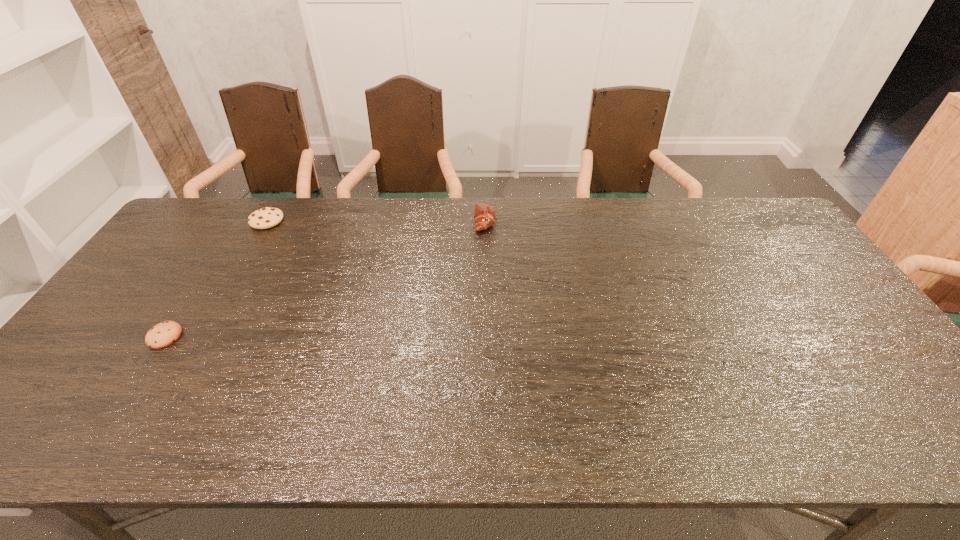
The width and height of the screenshot is (960, 540). I want to click on blank region between the nearest object and the crescent roll, so click(x=324, y=279).

You are a GUI agent. You are given a task and a screenshot of the screen. Output one action in this format:
    pyautogui.click(x=<x>, y=<y>)
    Task: Click on the vacant point located between the taller cookie and the nearer cookie
    The height and width of the screenshot is (540, 960).
    Given the screenshot: What is the action you would take?
    pyautogui.click(x=216, y=278)

At what (x,y) coordinates should I click in order to perform the action: click on unoccupied area between the taller cookie and the crescent roll. Please return your answer as a coordinate pair (x, y). This screenshot has width=960, height=540. Looking at the image, I should click on (375, 221).

Identify the location of free area in between the rightmost object and the taller cookie. This screenshot has height=540, width=960. (375, 221).

You are a GUI agent. You are given a task and a screenshot of the screen. Output one action in this format:
    pyautogui.click(x=<x>, y=<y>)
    Task: Click on the vacant area that lies between the second tallest object and the tallest object
    This screenshot has height=540, width=960.
    Given the screenshot: What is the action you would take?
    (x=375, y=221)

Locate an element on the screen. This screenshot has width=960, height=540. free space between the rightmost object and the farther cookie is located at coordinates (375, 221).

This screenshot has width=960, height=540. Find the location of `empty space that is in between the tallest object and the farther cookie`. empty space that is in between the tallest object and the farther cookie is located at coordinates (375, 221).

Where is `the second closest object to the tallest object`? the second closest object to the tallest object is located at coordinates (163, 334).

You are a GUI agent. You are given a task and a screenshot of the screen. Output one action in this format:
    pyautogui.click(x=<x>, y=<y>)
    Task: Click on the second closest object to the nearer cookie
    The image size is (960, 540).
    Given the screenshot: What is the action you would take?
    (x=484, y=216)

Where is `free region that satisfies the following two spatial constraints: 1. on the back side of the nearer cookie; 2. on the right side of the rightmost object`? The image size is (960, 540). free region that satisfies the following two spatial constraints: 1. on the back side of the nearer cookie; 2. on the right side of the rightmost object is located at coordinates (239, 221).